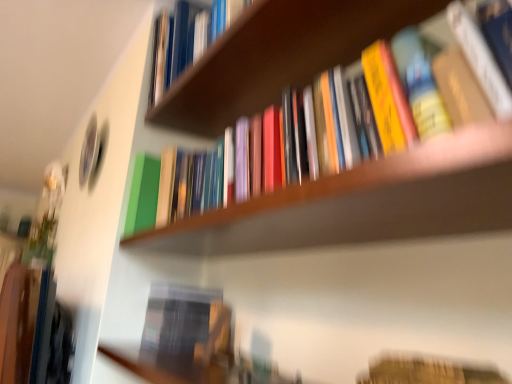
This screenshot has width=512, height=384. Find the location of `hardcover book at upper center, the third book in the bottom-to-top sequence`. hardcover book at upper center, the third book in the bottom-to-top sequence is located at coordinates (186, 39).

Identify the location of hardcover books at upper center, which is counted as the 2th book, starting from the bottom. (276, 56).

The height and width of the screenshot is (384, 512). What do you see at coordinates (426, 371) in the screenshot?
I see `hardcover book at lower right, the 3th book in the top-to-bottom sequence` at bounding box center [426, 371].

Where is `hardcover book at upper center, the third book in the bottom-to-top sequence`? Image resolution: width=512 pixels, height=384 pixels. hardcover book at upper center, the third book in the bottom-to-top sequence is located at coordinates (186, 39).

Is wooden bookshelf at upper center not close to hardcover books at upper center, the 2th book positioned from the top?

wooden bookshelf at upper center is actually quite close to hardcover books at upper center, the 2th book positioned from the top.

Is point (187, 105) positioned after point (330, 49)?

Yes, it is behind point (330, 49).

Could you tell me if wooden bookshelf at upper center is turned towards hardcover books at upper center, the 2th book positioned from the top?

No, wooden bookshelf at upper center is not turned towards hardcover books at upper center, the 2th book positioned from the top.

Visually, is wooden bookshelf at upper center positioned to the left or to the right of hardcover books at upper center, the 2th book positioned from the top?

In the image, wooden bookshelf at upper center appears on the left side of hardcover books at upper center, the 2th book positioned from the top.

Which is more to the left, hardcover book at lower right, the 3th book in the top-to-bottom sequence, or hardcover book at upper center, arranged as the first book when viewed from the top?

From the viewer's perspective, hardcover book at upper center, arranged as the first book when viewed from the top, appears more on the left side.

The width and height of the screenshot is (512, 384). Find the location of `the 2nd book positioned above the hardcover book at lower right, the 3th book in the top-to-bottom sequence (from the image's perspective)`. the 2nd book positioned above the hardcover book at lower right, the 3th book in the top-to-bottom sequence (from the image's perspective) is located at coordinates (186, 39).

Is the position of hardcover book at lower right, acting as the 1th book starting from the bottom, more distant than that of hardcover book at upper center, the third book in the bottom-to-top sequence?

No, it is in front of hardcover book at upper center, the third book in the bottom-to-top sequence.

Looking at this image, considering the positions of objects hardcover book at upper center, the third book in the bottom-to-top sequence, and wooden bookshelf at center in the image provided, who is more to the left, hardcover book at upper center, the third book in the bottom-to-top sequence, or wooden bookshelf at center?

hardcover book at upper center, the third book in the bottom-to-top sequence, is more to the left.

Considering the sizes of hardcover book at upper center, the third book in the bottom-to-top sequence, and wooden bookshelf at center in the image, is hardcover book at upper center, the third book in the bottom-to-top sequence, wider or thinner than wooden bookshelf at center?

hardcover book at upper center, the third book in the bottom-to-top sequence, is thinner than wooden bookshelf at center.

Is hardcover book at upper center, arranged as the first book when viewed from the top, further to camera compared to wooden bookshelf at center?

That is True.

Looking at this image, from the image's perspective, is hardcover book at upper center, arranged as the first book when viewed from the top, above or below hardcover books at upper center, the 2th book positioned from the top?

hardcover book at upper center, arranged as the first book when viewed from the top, is above hardcover books at upper center, the 2th book positioned from the top.

How different are the orientations of hardcover book at upper center, arranged as the first book when viewed from the top, and hardcover books at upper center, the 2th book positioned from the top, in degrees?

There is a 0.0012-degree angle between the facing directions of hardcover book at upper center, arranged as the first book when viewed from the top, and hardcover books at upper center, the 2th book positioned from the top.

From a real-world perspective, is hardcover book at upper center, the third book in the bottom-to-top sequence, located higher than hardcover books at upper center, which is counted as the 2th book, starting from the bottom?

Indeed, from a real-world perspective, hardcover book at upper center, the third book in the bottom-to-top sequence, stands above hardcover books at upper center, which is counted as the 2th book, starting from the bottom.

From a real-world perspective, is wooden bookshelf at center below wooden bookshelf at upper center?

Correct, in the physical world, wooden bookshelf at center is lower than wooden bookshelf at upper center.

Could you tell me if wooden bookshelf at center is turned towards wooden bookshelf at upper center?

No, wooden bookshelf at center is not oriented towards wooden bookshelf at upper center.

What's the angular difference between wooden bookshelf at center and wooden bookshelf at upper center's facing directions?

The facing directions of wooden bookshelf at center and wooden bookshelf at upper center are 0.000565 degrees apart.

Looking at this image, in the image, is wooden bookshelf at center positioned in front of or behind wooden bookshelf at upper center?

Visually, wooden bookshelf at center is located in front of wooden bookshelf at upper center.

Between hardcover books at upper center, the 2th book positioned from the top, and hardcover book at lower right, acting as the 1th book starting from the bottom, which one has less height?

hardcover book at lower right, acting as the 1th book starting from the bottom, is shorter.

Is hardcover books at upper center, which is counted as the 2th book, starting from the bottom, turned away from hardcover book at lower right, the 3th book in the top-to-bottom sequence?

No, hardcover books at upper center, which is counted as the 2th book, starting from the bottom, is not facing the opposite direction of hardcover book at lower right, the 3th book in the top-to-bottom sequence.

Image resolution: width=512 pixels, height=384 pixels. Find the location of `the 1st book behind when counting from the hardcover books at upper center, the 2th book positioned from the top`. the 1st book behind when counting from the hardcover books at upper center, the 2th book positioned from the top is located at coordinates (426, 371).

Is hardcover books at upper center, which is counted as the 2th book, starting from the bottom, smaller than hardcover book at lower right, the 3th book in the top-to-bottom sequence?

Actually, hardcover books at upper center, which is counted as the 2th book, starting from the bottom, might be larger than hardcover book at lower right, the 3th book in the top-to-bottom sequence.

Consider the image. Who is bigger, wooden bookshelf at upper center or hardcover book at upper center, the third book in the bottom-to-top sequence?

wooden bookshelf at upper center is bigger.

Between wooden bookshelf at upper center and hardcover book at upper center, arranged as the first book when viewed from the top, which one has less height?

Standing shorter between the two is wooden bookshelf at upper center.

Which is more to the left, wooden bookshelf at upper center or hardcover book at upper center, the third book in the bottom-to-top sequence?

hardcover book at upper center, the third book in the bottom-to-top sequence, is more to the left.

From the image's perspective, which one is positioned higher, wooden bookshelf at upper center or hardcover book at upper center, the third book in the bottom-to-top sequence?

From the image's view, hardcover book at upper center, the third book in the bottom-to-top sequence, is above.

Where is `the 1st book below when counting from the wooden bookshelf at upper center (from the image's perspective)`? The height and width of the screenshot is (384, 512). the 1st book below when counting from the wooden bookshelf at upper center (from the image's perspective) is located at coordinates (276, 56).

In order to click on the 1st book in front when counting from the hardcover book at upper center, the third book in the bottom-to-top sequence in this screenshot , I will do `click(426, 371)`.

Which object lies nearer to the anchor point hardcover books at upper center, the 2th book positioned from the top, wooden bookshelf at center or hardcover book at upper center, arranged as the first book when viewed from the top?

Based on the image, hardcover book at upper center, arranged as the first book when viewed from the top, appears to be nearer to hardcover books at upper center, the 2th book positioned from the top.

When comparing their distances from hardcover book at upper center, the third book in the bottom-to-top sequence, does hardcover books at upper center, which is counted as the 2th book, starting from the bottom, or wooden bookshelf at upper center seem further?

wooden bookshelf at upper center is further to hardcover book at upper center, the third book in the bottom-to-top sequence.

Based on their spatial positions, is wooden bookshelf at center or hardcover books at upper center, which is counted as the 2th book, starting from the bottom, further from wooden bookshelf at upper center?

The object further to wooden bookshelf at upper center is wooden bookshelf at center.

Based on their spatial positions, is hardcover book at lower right, the 3th book in the top-to-bottom sequence, or wooden bookshelf at center further from hardcover book at upper center, arranged as the first book when viewed from the top?

hardcover book at lower right, the 3th book in the top-to-bottom sequence.

When comparing their distances from hardcover books at upper center, which is counted as the 2th book, starting from the bottom, does hardcover book at lower right, acting as the 1th book starting from the bottom, or wooden bookshelf at upper center seem further?

The object further to hardcover books at upper center, which is counted as the 2th book, starting from the bottom, is hardcover book at lower right, acting as the 1th book starting from the bottom.

When comparing their distances from wooden bookshelf at center, does wooden bookshelf at upper center or hardcover book at upper center, the third book in the bottom-to-top sequence, seem further?

hardcover book at upper center, the third book in the bottom-to-top sequence, is positioned further to the anchor wooden bookshelf at center.

From the image, which object appears to be nearer to hardcover book at lower right, the 3th book in the top-to-bottom sequence, wooden bookshelf at center or wooden bookshelf at upper center?

wooden bookshelf at center is positioned closer to the anchor hardcover book at lower right, the 3th book in the top-to-bottom sequence.

From the image, which object appears to be farther from wooden bookshelf at center, hardcover books at upper center, which is counted as the 2th book, starting from the bottom, or hardcover book at lower right, the 3th book in the top-to-bottom sequence?

hardcover books at upper center, which is counted as the 2th book, starting from the bottom, is further to wooden bookshelf at center.

The height and width of the screenshot is (384, 512). I want to click on shelf between hardcover books at upper center, which is counted as the 2th book, starting from the bottom, and hardcover book at lower right, the 3th book in the top-to-bottom sequence, vertically, so click(364, 202).

You are a GUI agent. You are given a task and a screenshot of the screen. Output one action in this format:
    pyautogui.click(x=<x>, y=<y>)
    Task: Click on the cabinet located between hardcover book at lower right, acting as the 1th book starting from the bottom, and hardcover book at upper center, the third book in the bottom-to-top sequence, in the depth direction
    The width and height of the screenshot is (512, 384).
    Given the screenshot: What is the action you would take?
    pyautogui.click(x=278, y=56)

Locate an element on the screen. The height and width of the screenshot is (384, 512). cabinet between hardcover books at upper center, the 2th book positioned from the top, and hardcover book at upper center, the third book in the bottom-to-top sequence, from front to back is located at coordinates (278, 56).

The width and height of the screenshot is (512, 384). Find the location of `shelf between wooden bookshelf at upper center and hardcover book at lower right, the 3th book in the top-to-bottom sequence, from top to bottom`. shelf between wooden bookshelf at upper center and hardcover book at lower right, the 3th book in the top-to-bottom sequence, from top to bottom is located at coordinates (364, 202).